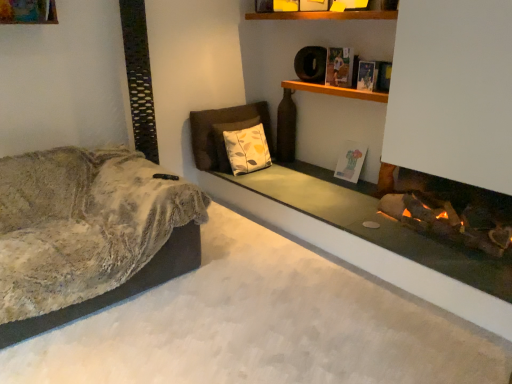
At what (x,y) coordinates should I click in order to perform the action: click on hardcover book at upper right, the 1th book when ordered from front to back. Please return your answer as a coordinate pair (x, y). Looking at the image, I should click on (367, 75).

What are the coordinates of `fuzzy beige couch at left` in the screenshot? It's located at (88, 234).

In order to click on smooth concrete fireplace at lower right in this screenshot , I will do `click(369, 257)`.

Based on the photo, would you consider floral-patterned fabric pillow at center to be distant from smooth concrete fireplace at lower right?

No, floral-patterned fabric pillow at center is not far from smooth concrete fireplace at lower right.

Considering the positions of point (254, 142) and point (292, 212), is point (254, 142) closer or farther from the camera than point (292, 212)?

Point (254, 142) is positioned farther from the camera compared to point (292, 212).

In the image, is floral-patterned fabric pillow at center on the left side or the right side of smooth concrete fireplace at lower right?

Based on their positions, floral-patterned fabric pillow at center is located to the left of smooth concrete fireplace at lower right.

From a real-world perspective, is floral-patterned fabric pillow at center physically below smooth concrete fireplace at lower right?

No, from a real-world perspective, floral-patterned fabric pillow at center is not beneath smooth concrete fireplace at lower right.

Which object is wider, matte white book at center, positioned as the 3th book in front-to-back order, or wooden at upper center?

Wider between the two is wooden at upper center.

Does point (345, 146) appear closer or farther from the camera than point (310, 89)?

Clearly, point (345, 146) is more distant from the camera than point (310, 89).

From the image's perspective, which object appears higher, matte white book at center, the first book when ordered from back to front, or wooden at upper center?

wooden at upper center appears higher in the image.

Does point (347, 69) appear closer or farther from the camera than point (362, 64)?

Point (347, 69) is farther from the camera than point (362, 64).

Based on the photo, who is taller, hardcover book at upper center, which appears as the second book when viewed from the front, or hardcover book at upper right, the 1th book when ordered from front to back?

hardcover book at upper center, which appears as the second book when viewed from the front.

Is hardcover book at upper center, which appears as the second book when viewed from the front, facing towards hardcover book at upper right, which is counted as the second book, starting from the top?

No.

From a real-world perspective, which object stands above the other?

hardcover book at upper center, the 3th book from the bottom, from a real-world perspective.

Which object is more forward, hardcover book at upper right, arranged as the third book when viewed from the back, or floral-patterned fabric pillow at center?

hardcover book at upper right, arranged as the third book when viewed from the back, is in front.

Is hardcover book at upper right, the 2th book when ordered from bottom to top, not close to floral-patterned fabric pillow at center?

Absolutely, hardcover book at upper right, the 2th book when ordered from bottom to top, is distant from floral-patterned fabric pillow at center.

Considering the relative positions of hardcover book at upper right, which is counted as the second book, starting from the top, and floral-patterned fabric pillow at center in the image provided, is hardcover book at upper right, which is counted as the second book, starting from the top, to the right of floral-patterned fabric pillow at center from the viewer's perspective?

Indeed, hardcover book at upper right, which is counted as the second book, starting from the top, is positioned on the right side of floral-patterned fabric pillow at center.

Does point (376, 66) come closer to viewer compared to point (241, 162)?

Yes.

Considering the relative positions of floral-patterned fabric pillow at center and matte white book at center, arranged as the 1th book when ordered from the bottom, in the image provided, is floral-patterned fabric pillow at center to the left of matte white book at center, arranged as the 1th book when ordered from the bottom, from the viewer's perspective?

Correct, you'll find floral-patterned fabric pillow at center to the left of matte white book at center, arranged as the 1th book when ordered from the bottom.

Measure the distance from floral-patterned fabric pillow at center to matte white book at center, arranged as the 1th book when ordered from the bottom.

floral-patterned fabric pillow at center and matte white book at center, arranged as the 1th book when ordered from the bottom, are 32.11 inches apart.

Is floral-patterned fabric pillow at center completely or partially outside of matte white book at center, positioned as the 3th book in front-to-back order?

floral-patterned fabric pillow at center is positioned outside matte white book at center, positioned as the 3th book in front-to-back order.

Between floral-patterned fabric pillow at center and matte white book at center, arranged as the 1th book when ordered from the bottom, which one has smaller size?

matte white book at center, arranged as the 1th book when ordered from the bottom, is smaller.

Between wooden at upper center and hardcover book at upper right, which is counted as the second book, starting from the top, which one has larger width?

With larger width is wooden at upper center.

Is wooden at upper center to the left of hardcover book at upper right, arranged as the third book when viewed from the back, from the viewer's perspective?

Yes, wooden at upper center is to the left of hardcover book at upper right, arranged as the third book when viewed from the back.

From the image's perspective, between wooden at upper center and hardcover book at upper right, the 2th book when ordered from bottom to top, which one is located above?

hardcover book at upper right, the 2th book when ordered from bottom to top, is shown above in the image.

Which is less distant, (x=349, y=91) or (x=364, y=66)?

Positioned in front is point (x=364, y=66).

From the image's perspective, which is below, fuzzy beige couch at left or smooth concrete fireplace at lower right?

fuzzy beige couch at left is shown below in the image.

Is point (61, 251) farther from viewer compared to point (467, 299)?

Yes, point (61, 251) is behind point (467, 299).

Between fuzzy beige couch at left and smooth concrete fireplace at lower right, which one has smaller width?

smooth concrete fireplace at lower right is thinner.

This screenshot has width=512, height=384. I want to click on mantle located on the right of floral-patterned fabric pillow at center, so click(369, 257).

From the wooden at upper center, count 3rd books backward and point to it. Please provide its 2D coordinates.

[(350, 161)]

Estimate the real-world distances between objects in this image. Which object is closer to hardcover book at upper center, which ranks as the first book in top-to-bottom order, matte white book at center, positioned as the 3th book in front-to-back order, or wooden at upper center?

The object closer to hardcover book at upper center, which ranks as the first book in top-to-bottom order, is wooden at upper center.

From the picture: Which object lies further to the anchor point hardcover book at upper right, which is counted as the second book, starting from the top, fuzzy beige couch at left or matte white book at center, positioned as the 3th book in front-to-back order?

The object further to hardcover book at upper right, which is counted as the second book, starting from the top, is fuzzy beige couch at left.

Which object lies nearer to the anchor point hardcover book at upper center, the 3th book from the bottom, wooden at upper center or fuzzy beige couch at left?

Based on the image, wooden at upper center appears to be nearer to hardcover book at upper center, the 3th book from the bottom.

In the scene shown: When comparing their distances from hardcover book at upper center, which appears as the second book when viewed from the back, does wooden at upper center or matte white book at center, positioned as the 3th book in front-to-back order, seem further?

matte white book at center, positioned as the 3th book in front-to-back order, lies further to hardcover book at upper center, which appears as the second book when viewed from the back, than the other object.

From the image, which object appears to be nearer to wooden at upper center, hardcover book at upper right, the 2th book when ordered from bottom to top, or smooth concrete fireplace at lower right?

hardcover book at upper right, the 2th book when ordered from bottom to top, is closer to wooden at upper center.

When comparing their distances from wooden at upper center, does hardcover book at upper right, which is counted as the second book, starting from the top, or floral-patterned fabric pillow at center seem further?

floral-patterned fabric pillow at center lies further to wooden at upper center than the other object.

Based on their spatial positions, is hardcover book at upper right, the 1th book when ordered from front to back, or floral-patterned fabric pillow at center closer to hardcover book at upper center, the 3th book from the bottom?

hardcover book at upper right, the 1th book when ordered from front to back.

Which object lies further to the anchor point hardcover book at upper right, the 1th book when ordered from front to back, floral-patterned fabric pillow at center or wooden at upper center?

floral-patterned fabric pillow at center is further to hardcover book at upper right, the 1th book when ordered from front to back.

At what (x,y) coordinates should I click in order to perform the action: click on mantle situated between fuzzy beige couch at left and wooden at upper center from left to right. Please return your answer as a coordinate pair (x, y). Looking at the image, I should click on (369, 257).

In order to click on book between fuzzy beige couch at left and wooden at upper center in this screenshot , I will do `click(339, 67)`.

Where is `mantle between fuzzy beige couch at left and floral-patterned fabric pillow at center in the front-back direction`? The image size is (512, 384). mantle between fuzzy beige couch at left and floral-patterned fabric pillow at center in the front-back direction is located at coordinates (369, 257).

Find the location of a particular element. Image resolution: width=512 pixels, height=384 pixels. shelf between smooth concrete fireplace at lower right and floral-patterned fabric pillow at center along the z-axis is located at coordinates (335, 91).